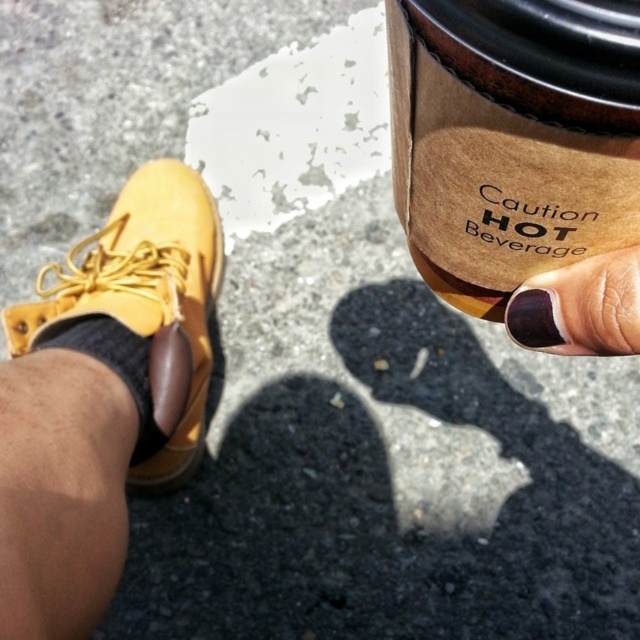
Question: Among these objects, which one is farthest from the camera?

Choices:
 (A) brown suede cup at upper right
 (B) suede/yellow shoe at lower left
 (C) dark purple nail polish at upper right

Answer: (B)

Question: Is brown suede cup at upper right above suede/yellow shoe at lower left?

Choices:
 (A) yes
 (B) no

Answer: (B)

Question: Which object is positioned farthest from the suede/yellow shoe at lower left?

Choices:
 (A) brown suede cup at upper right
 (B) dark purple nail polish at upper right

Answer: (B)

Question: Among these objects, which one is nearest to the camera?

Choices:
 (A) dark purple nail polish at upper right
 (B) suede/yellow shoe at lower left

Answer: (A)

Question: Is suede/yellow shoe at lower left in front of dark purple nail polish at upper right?

Choices:
 (A) no
 (B) yes

Answer: (A)

Question: Is suede/yellow shoe at lower left bigger than dark purple nail polish at upper right?

Choices:
 (A) yes
 (B) no

Answer: (A)